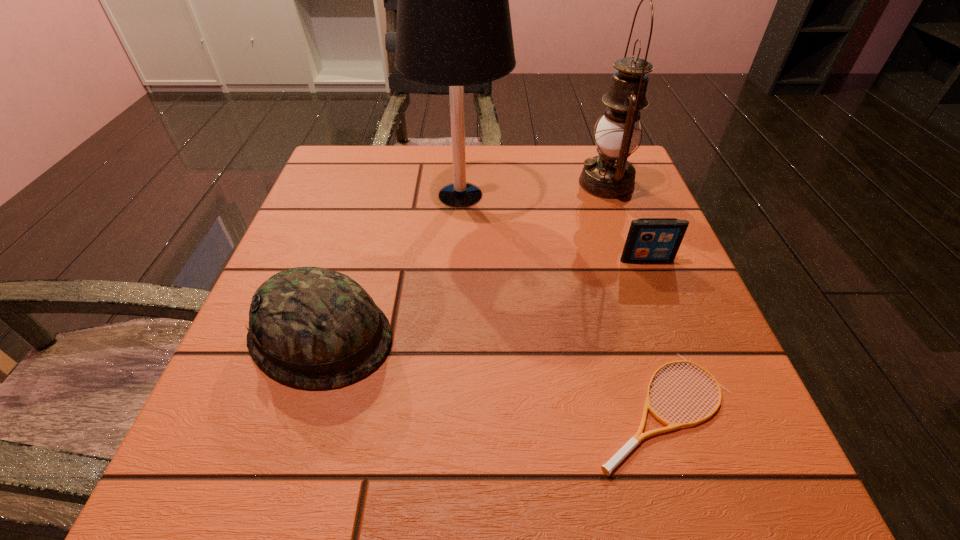
This screenshot has height=540, width=960. I want to click on table lamp, so click(x=453, y=29).

Image resolution: width=960 pixels, height=540 pixels. In order to click on oil lamp in this screenshot , I will do `click(609, 175)`.

At what (x,y) coordinates should I click in order to perform the action: click on headwear. Please return your answer as a coordinate pair (x, y). This screenshot has width=960, height=540. Looking at the image, I should click on 312,327.

Locate an element on the screen. the fourth tallest object is located at coordinates (650, 240).

Image resolution: width=960 pixels, height=540 pixels. I want to click on the third nearest object, so click(x=650, y=240).

The image size is (960, 540). What are the coordinates of `tennis racket` in the screenshot? It's located at (607, 468).

In order to click on vacant region located on the front of the table lamp in this screenshot , I will do `click(450, 388)`.

This screenshot has width=960, height=540. In order to click on vacant position located 0.380m on the front of the oil lamp in this screenshot , I will do `click(667, 350)`.

Where is `vacant area situated on the right of the third tallest object`? The image size is (960, 540). vacant area situated on the right of the third tallest object is located at coordinates (553, 336).

Where is `vacant space located 0.050m on the front screen of the iPod`? Image resolution: width=960 pixels, height=540 pixels. vacant space located 0.050m on the front screen of the iPod is located at coordinates (656, 283).